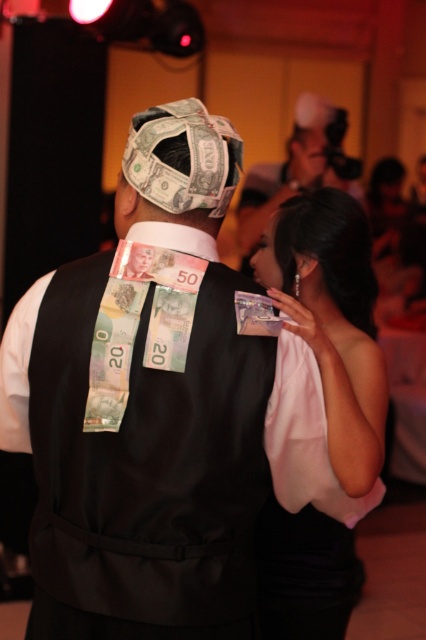
You are a photographer at the event and want to capture a photo of the crinkled paper money at center and the smooth skin head at upper right in the same frame. Your camera has a maximum focus range of 5 meters. Can both objects be in focus?

The distance between the crinkled paper money at center and the smooth skin head at upper right is 5.22 meters, which exceeds the camera maximum focus range of 5 meters. Therefore, both objects cannot be in focus simultaneously.

What is the 2D coordinate of the crinkled paper money at center?

The crinkled paper money at center is located at the 2D coordinate point of (181, 170).

You are a guest at the event and want to take a photo of the male figure with the hat made of dollar bills. The camera you are using has a focus point at coordinate point (181, 170). Will this point be on the hat made of dollar bills?

The point (181, 170) marks crinkled paper money at center, so yes, the focus point will be on the hat made of dollar bills since the hat is constructed from crinkled paper money.